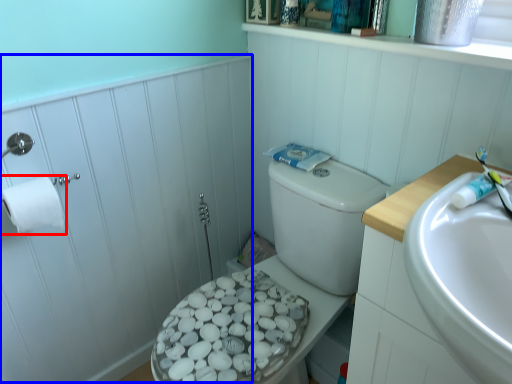
Question: Which of the following is the farthest to the observer, toilet paper (highlighted by a red box) or side (highlighted by a blue box)?

Choices:
 (A) toilet paper
 (B) side

Answer: (A)